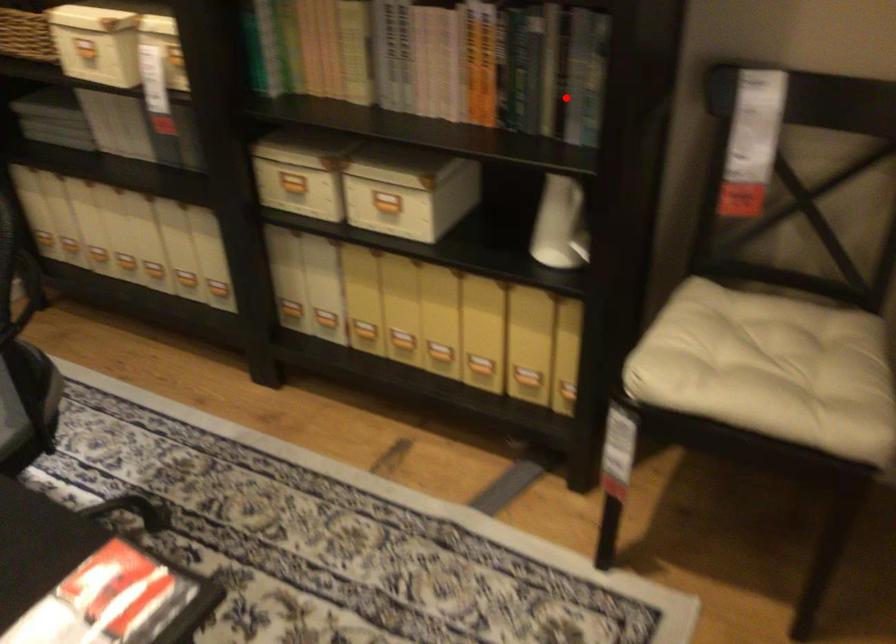
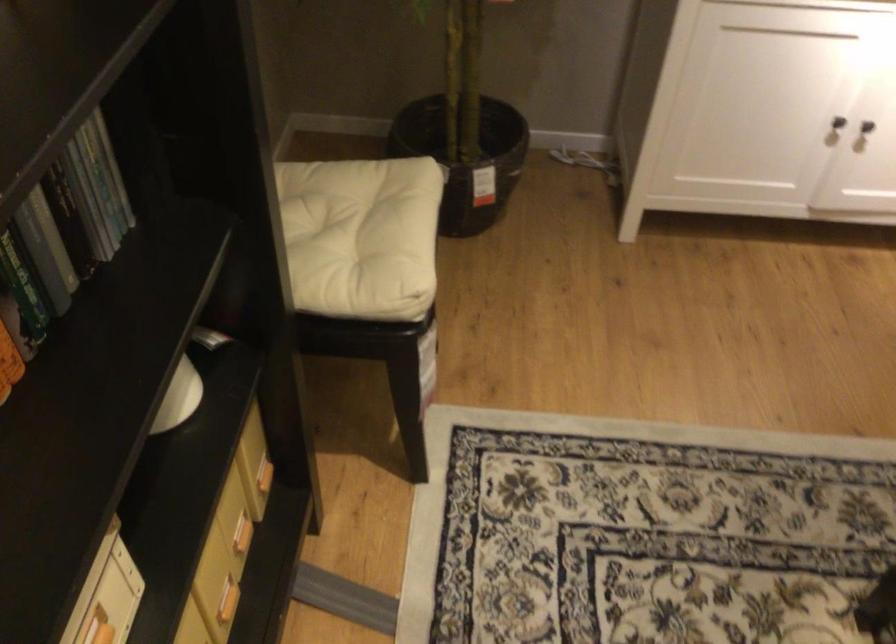
Question: I am providing you with two images of the same scene from different viewpoints. In image1, a red point is highlighted. Considering the same 3D point in image2, which of the following is correct?

Choices:
 (A) It is closer
 (B) It is farther

Answer: (A)